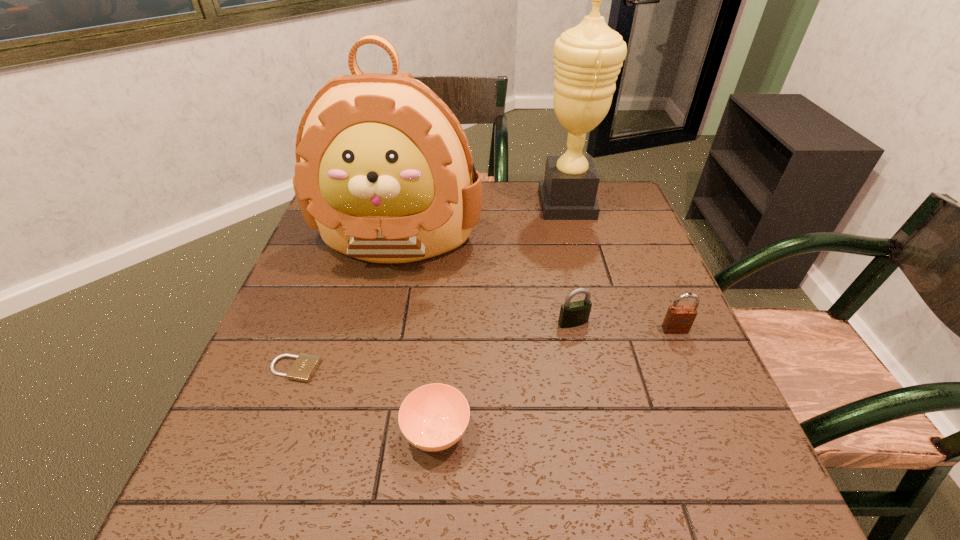
At what (x,y) coordinates should I click in order to perform the action: click on object that stands as the fourth closest to the nearest object. Please return your answer as a coordinate pair (x, y). Image resolution: width=960 pixels, height=540 pixels. Looking at the image, I should click on (679, 319).

I want to click on object that can be found as the second closest to the shortest object, so click(384, 170).

Choose which padlock is the nearest neighbor to the soup bowl. Please provide its 2D coordinates. Your answer should be formatted as a tuple, i.e. [(x, y)], where the tuple contains the x and y coordinates of a point satisfying the conditions above.

[(304, 367)]

You are a GUI agent. You are given a task and a screenshot of the screen. Output one action in this format:
    pyautogui.click(x=<x>, y=<y>)
    Task: Click on the padlock that is the second closest one to the shortest padlock
    The image size is (960, 540).
    Given the screenshot: What is the action you would take?
    pyautogui.click(x=679, y=319)

Image resolution: width=960 pixels, height=540 pixels. In order to click on vacant space that satisfies the following two spatial constraints: 1. on the front-facing side of the fifth shortest object; 2. on the left side of the second padlock from right to left in this screenshot , I will do `click(378, 322)`.

Where is `vacant space that satisfies the following two spatial constraints: 1. at the front of the trophy cup with handles; 2. on the front-facing side of the second tallest object`? The image size is (960, 540). vacant space that satisfies the following two spatial constraints: 1. at the front of the trophy cup with handles; 2. on the front-facing side of the second tallest object is located at coordinates (575, 237).

Where is `free space that satisfies the following two spatial constraints: 1. on the front-facing side of the backpack; 2. on the right side of the second padlock from right to left`? This screenshot has height=540, width=960. free space that satisfies the following two spatial constraints: 1. on the front-facing side of the backpack; 2. on the right side of the second padlock from right to left is located at coordinates (378, 322).